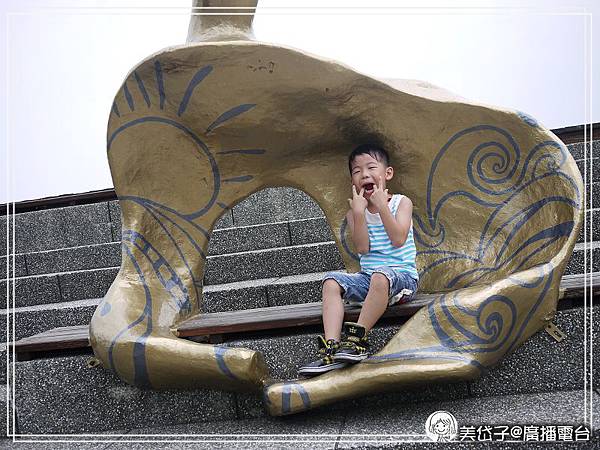
Find the location of a particular element. This screenshot has height=450, width=600. bench seat is located at coordinates point(273,315).